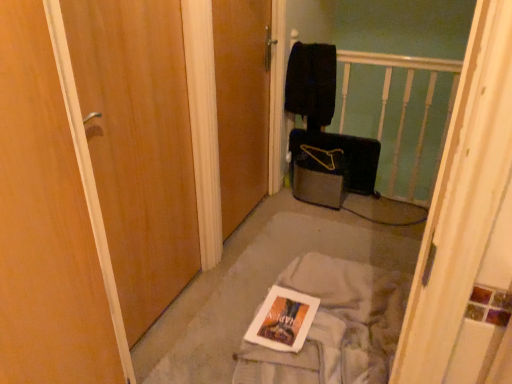
Question: Is wooden door at left, the 2th door in the right-to-left sequence, outside of white fabric at center?

Choices:
 (A) yes
 (B) no

Answer: (A)

Question: From the image's perspective, is wooden door at left, which is the first door in left-to-right order, located beneath white fabric at center?

Choices:
 (A) no
 (B) yes

Answer: (A)

Question: Is wooden door at left, which is the first door in left-to-right order, to the right of white fabric at center from the viewer's perspective?

Choices:
 (A) no
 (B) yes

Answer: (A)

Question: Does wooden door at left, which is the first door in left-to-right order, have a larger size compared to white fabric at center?

Choices:
 (A) yes
 (B) no

Answer: (A)

Question: From a real-world perspective, is wooden door at left, the 2th door in the right-to-left sequence, positioned under white fabric at center based on gravity?

Choices:
 (A) yes
 (B) no

Answer: (B)

Question: Is wooden door at left, which is the first door in left-to-right order, oriented towards white fabric at center?

Choices:
 (A) yes
 (B) no

Answer: (B)

Question: Is white glossy magazine at center to the left of white fabric at center from the viewer's perspective?

Choices:
 (A) no
 (B) yes

Answer: (B)

Question: Is white glossy magazine at center positioned before white fabric at center?

Choices:
 (A) yes
 (B) no

Answer: (B)

Question: Is white glossy magazine at center taller than white fabric at center?

Choices:
 (A) yes
 (B) no

Answer: (B)

Question: Does white glossy magazine at center have a greater width compared to white fabric at center?

Choices:
 (A) no
 (B) yes

Answer: (A)

Question: Is white glossy magazine at center smaller than white fabric at center?

Choices:
 (A) yes
 (B) no

Answer: (A)

Question: Is white glossy magazine at center beside white fabric at center?

Choices:
 (A) no
 (B) yes

Answer: (A)

Question: Considering the relative sizes of white fabric at center and wooden door at left, which is the first door in left-to-right order, in the image provided, is white fabric at center thinner than wooden door at left, which is the first door in left-to-right order,?

Choices:
 (A) yes
 (B) no

Answer: (B)